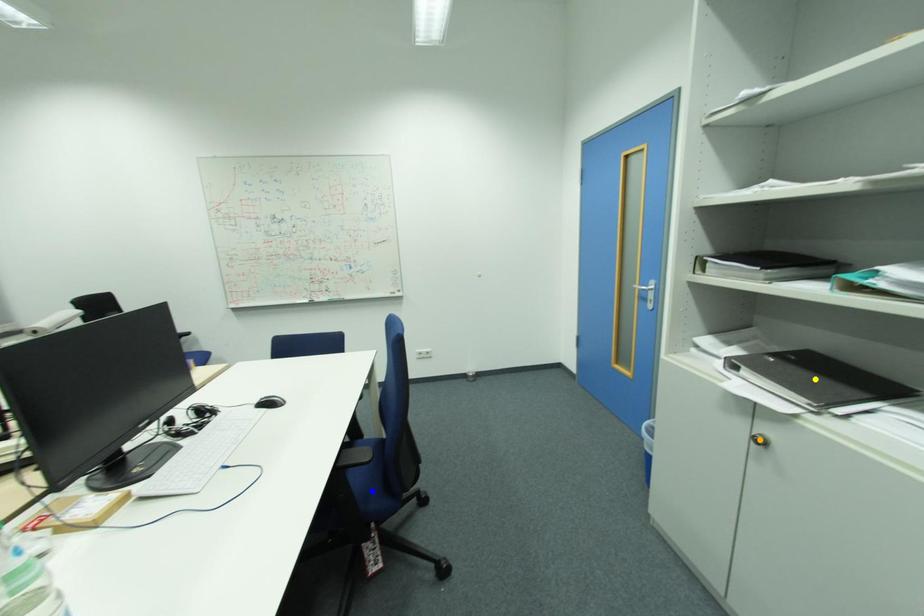
Order these from nearest to farthest:
yellow point | blue point | orange point

blue point, orange point, yellow point